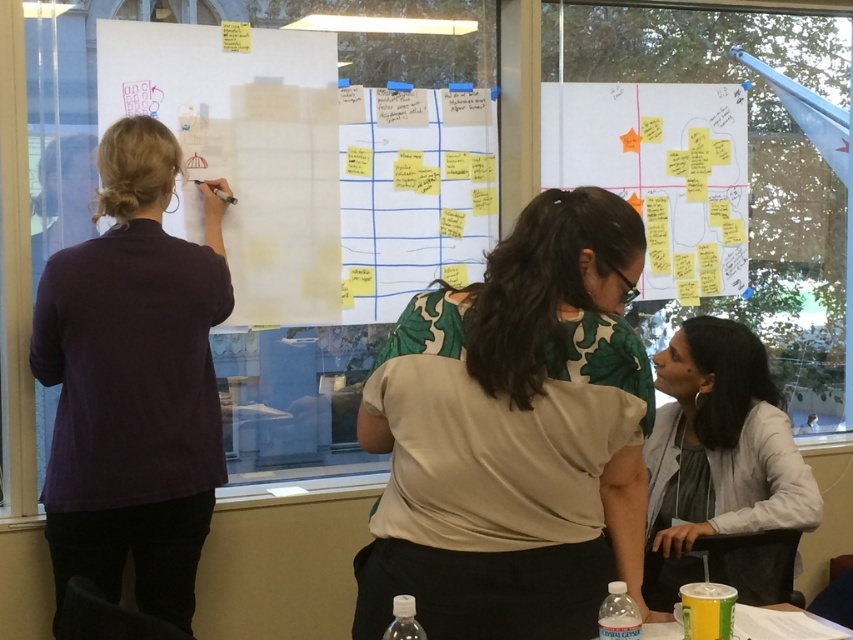
From the picture: You are a delivery robot with a package that needs to be placed between the purple cotton shirt at left and the clear plastic bottle at lower right. The robot has a maximum reach of 5 feet. Can you place the package directly between them without moving either object?

The distance between the purple cotton shirt at left and the clear plastic bottle at lower right is 4.60 feet, which is within the robot s 5 feet maximum reach. Therefore, the robot can place the package directly between them without needing to move either object.

You are a participant in the brainstorming session and need to refer to the whiteboard. While standing next to the green floral blouse at center, can you easily see the white matte paperboard at upper center without moving your head?

The green floral blouse at center is positioned under the white matte paperboard at upper center, so yes, you can easily see the white matte paperboard at upper center without moving your head since it is above the blouse.

You are standing at point [833,632] and want to walk to point [343,96]. Based on the scene description, will you need to move forward or backward?

You will need to move forward to reach point [343,96] because it is behind point [833,632] from your current position.